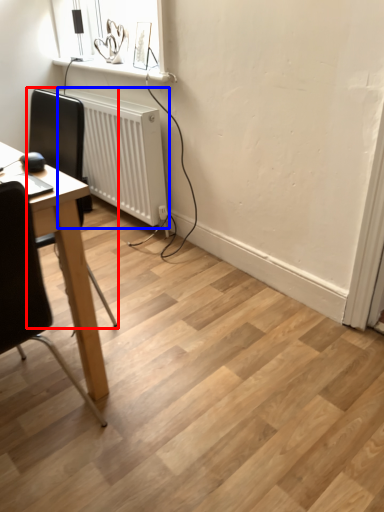
Question: Which of the following is the farthest to the observer, chair (highlighted by a red box) or radiator (highlighted by a blue box)?

Choices:
 (A) chair
 (B) radiator

Answer: (B)